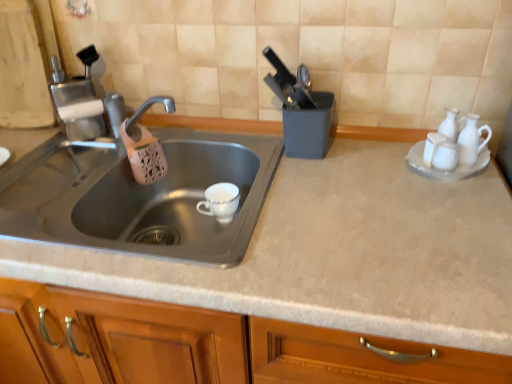
This screenshot has width=512, height=384. Find the location of `vacant space that is in between matte plastic knife block at upper right and white glossy salt shaker at upper right, positioned as the second tableware in front-to-back order`. vacant space that is in between matte plastic knife block at upper right and white glossy salt shaker at upper right, positioned as the second tableware in front-to-back order is located at coordinates (366, 153).